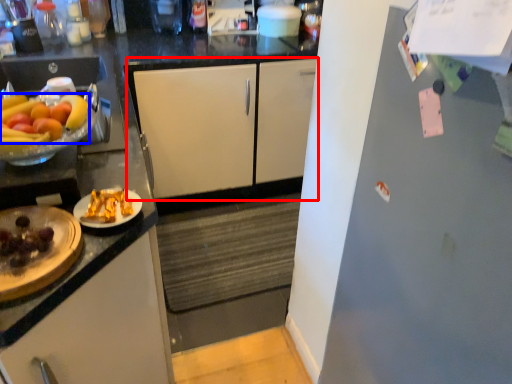
Question: Which object appears farthest to the camera in this image, cabinetry (highlighted by a red box) or grapefruit (highlighted by a blue box)?

Choices:
 (A) cabinetry
 (B) grapefruit

Answer: (A)